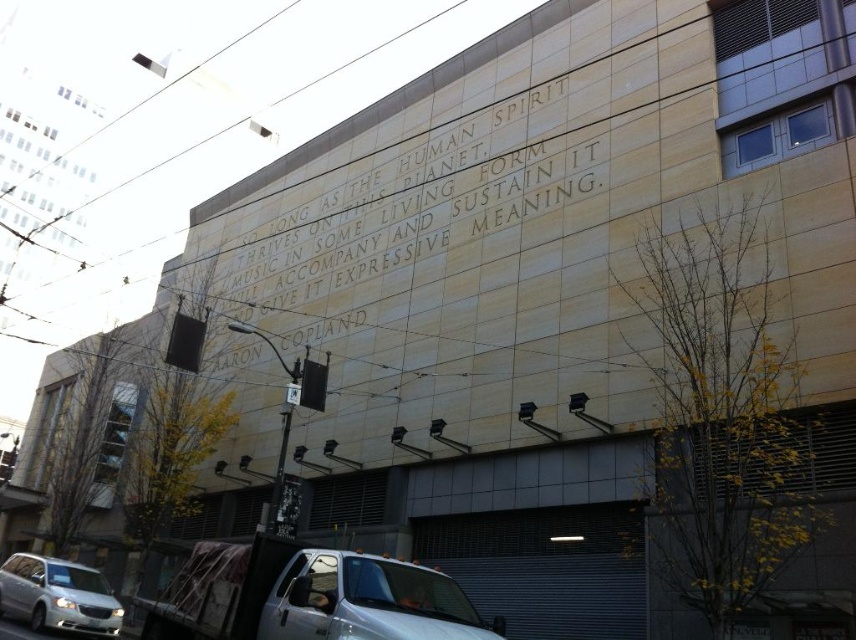
Does white glossy truck at lower center lie behind stone engraving at center?

No, white glossy truck at lower center is in front of stone engraving at center.

Who is taller, white glossy truck at lower center or stone engraving at center?

With more height is stone engraving at center.

Where is `white glossy truck at lower center`? The height and width of the screenshot is (640, 856). white glossy truck at lower center is located at coordinates (366, 600).

Locate an element on the screen. The image size is (856, 640). white glossy truck at lower center is located at coordinates (366, 600).

Is point (407, 636) positioned behind point (16, 582)?

No, (407, 636) is in front of (16, 582).

Between point (381, 637) and point (70, 598), which one is positioned in front?

Point (381, 637)

Where is `white glossy truck at lower center`? The height and width of the screenshot is (640, 856). white glossy truck at lower center is located at coordinates [366, 600].

Can you confirm if white matte van at lower left is taller than stone engraving at center?

No.

The height and width of the screenshot is (640, 856). What do you see at coordinates (58, 595) in the screenshot?
I see `white matte van at lower left` at bounding box center [58, 595].

Where is `white matte van at lower left`? The height and width of the screenshot is (640, 856). white matte van at lower left is located at coordinates (58, 595).